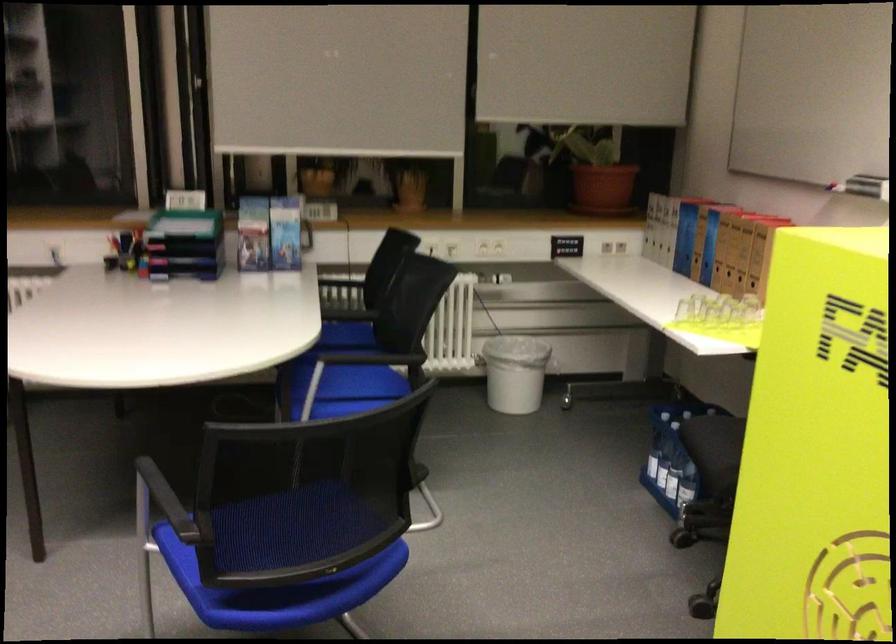
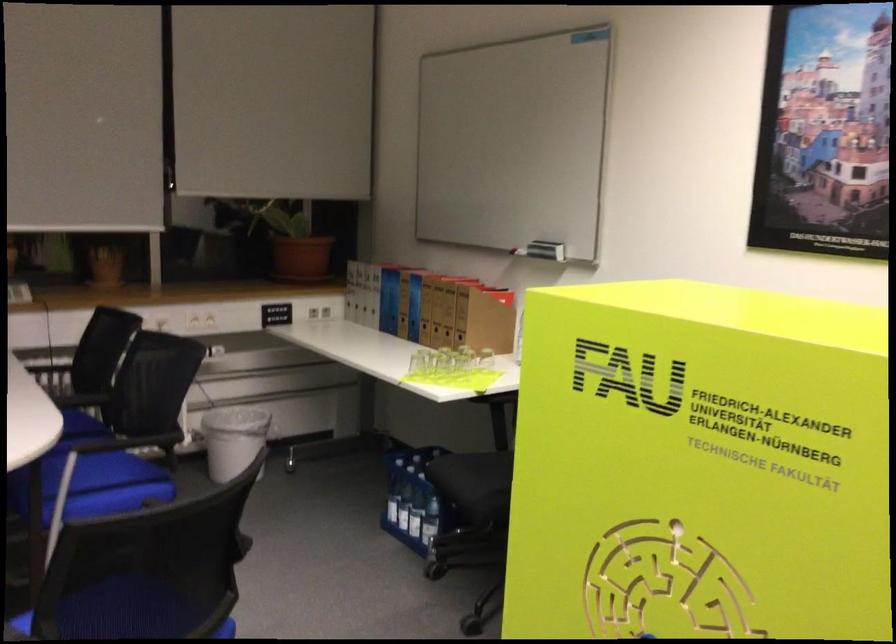
Locate, in the second image, the point that corresponds to point (653, 451) in the first image.

(392, 500)